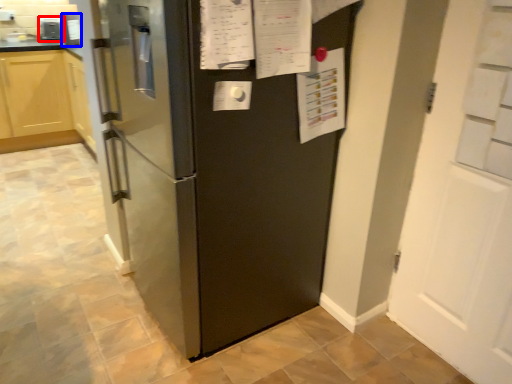
Question: Which point is further to the camera, appliance (highlighted by a red box) or appliance (highlighted by a blue box)?

Choices:
 (A) appliance
 (B) appliance

Answer: (A)